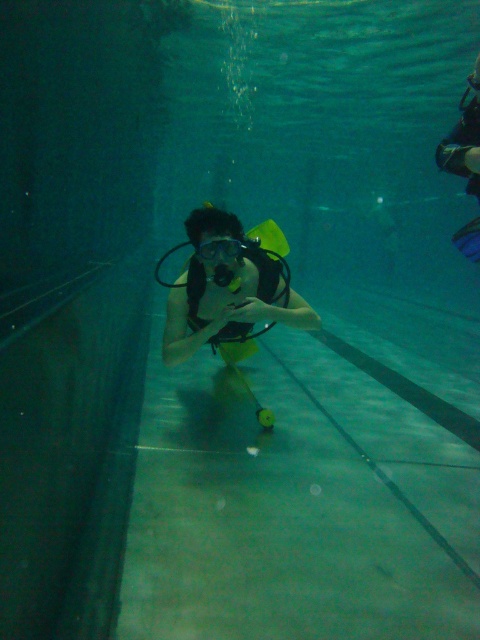
Which is behind, point (204, 268) or point (232, 248)?

The point (204, 268) is behind.

Is point (283, 273) positioned in front of point (240, 246)?

No, (283, 273) is behind (240, 246).

Who is more distant from viewer, (177, 300) or (212, 257)?

The point (177, 300) is more distant.

This screenshot has height=640, width=480. I want to click on yellow matte scuba gear at center, so click(x=228, y=291).